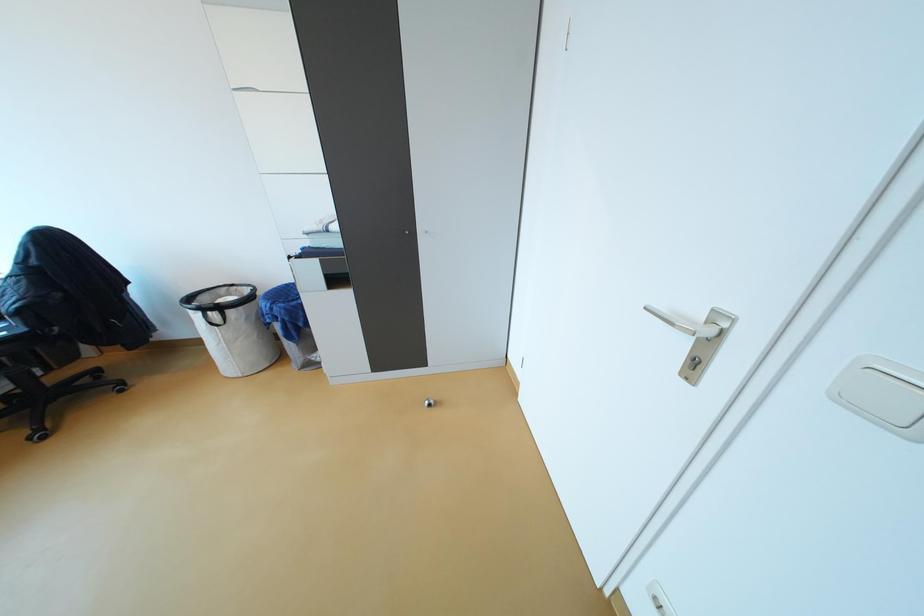
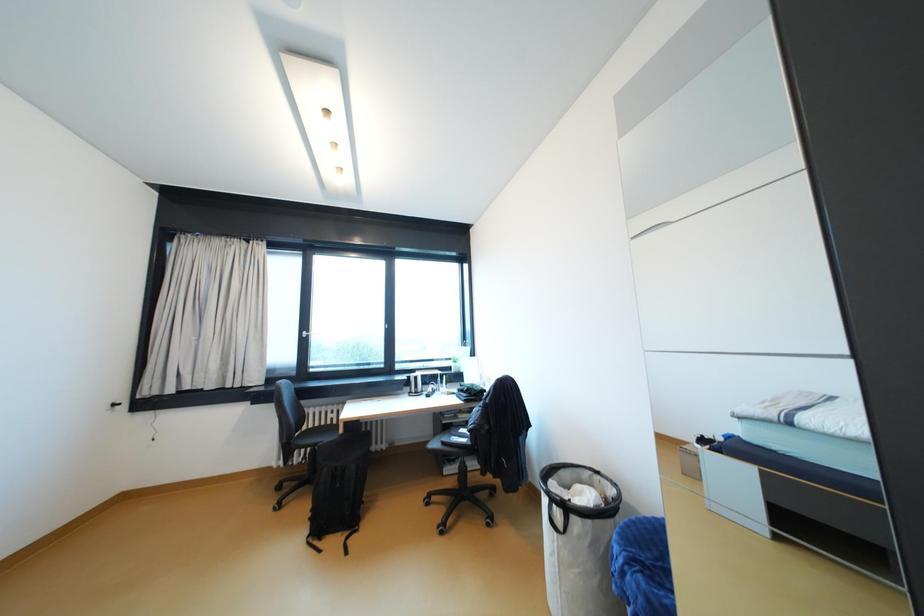
Question: How did the camera likely rotate?

Choices:
 (A) Left
 (B) Right
 (C) Up
 (D) Down

Answer: (A)